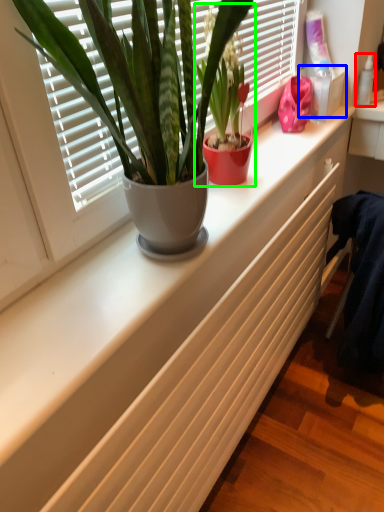
Question: Considering the real-world distances, which object is farthest from toiletry (highlighted by a red box)? window box (highlighted by a blue box) or houseplant (highlighted by a green box)?

Choices:
 (A) window box
 (B) houseplant

Answer: (B)